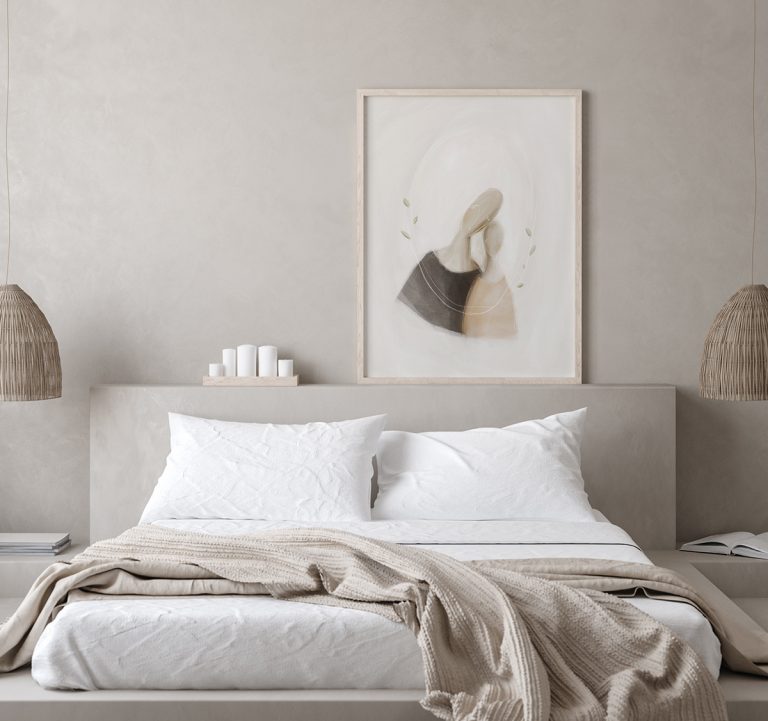
Image resolution: width=768 pixels, height=721 pixels. In order to click on frame in this screenshot , I will do `click(580, 262)`.